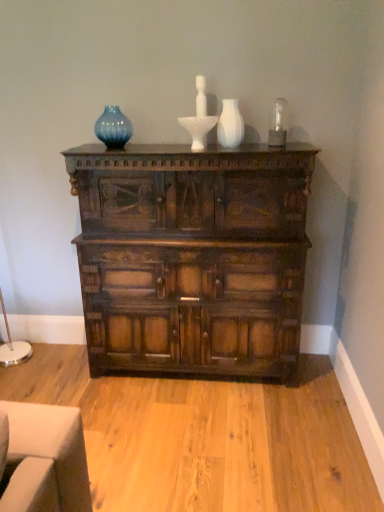
This screenshot has height=512, width=384. Describe the element at coordinates (192, 257) in the screenshot. I see `dark wood chest of drawers at center` at that location.

The height and width of the screenshot is (512, 384). In order to click on dark wood chest of drawers at center in this screenshot , I will do `click(192, 257)`.

What are the coordinates of `dark wood chest of drawers at center` in the screenshot? It's located at (192, 257).

Is white matte vase at center at the back of blue glass vase at upper center?

No.

From the image's perspective, is blue glass vase at upper center beneath white matte vase at center?

No, from the image's perspective, blue glass vase at upper center is not beneath white matte vase at center.

From their relative heights in the image, would you say blue glass vase at upper center is taller or shorter than white matte vase at center?

Clearly, blue glass vase at upper center is shorter compared to white matte vase at center.

How many degrees apart are the facing directions of blue glass vase at upper center and white matte vase at center?

1.41 degrees.

Would you say white matte vase at center is to the left or to the right of blue glass vase at upper center in the picture?

In the image, white matte vase at center appears on the right side of blue glass vase at upper center.

Measure the distance from white matte vase at center to blue glass vase at upper center.

white matte vase at center and blue glass vase at upper center are 26.08 inches apart.

Is white matte vase at center positioned with its back to blue glass vase at upper center?

No, white matte vase at center is not facing away from blue glass vase at upper center.

Is white matte vase at center next to blue glass vase at upper center?

white matte vase at center is not next to blue glass vase at upper center, and they're not touching.

Based on their sizes in the image, would you say white matte vase at center is bigger or smaller than dark wood chest of drawers at center?

In the image, white matte vase at center appears to be smaller than dark wood chest of drawers at center.

Could you tell me if white matte vase at center is facing dark wood chest of drawers at center?

No.

From a real-world perspective, between white matte vase at center and dark wood chest of drawers at center, who is vertically higher?

In real-world perspective, white matte vase at center is above.

Considering the relative sizes of white matte vase at center and dark wood chest of drawers at center in the image provided, is white matte vase at center wider than dark wood chest of drawers at center?

No, white matte vase at center is not wider than dark wood chest of drawers at center.

Considering the sizes of objects blue glass vase at upper center and dark wood chest of drawers at center in the image provided, who is bigger, blue glass vase at upper center or dark wood chest of drawers at center?

dark wood chest of drawers at center is bigger.

Considering the sizes of blue glass vase at upper center and dark wood chest of drawers at center in the image, is blue glass vase at upper center wider or thinner than dark wood chest of drawers at center?

In the image, blue glass vase at upper center appears to be more narrow than dark wood chest of drawers at center.

Could you tell me if blue glass vase at upper center is turned towards dark wood chest of drawers at center?

No, blue glass vase at upper center is not oriented towards dark wood chest of drawers at center.

Between point (115, 127) and point (288, 153), which one is positioned in front?

Positioned in front is point (288, 153).

Which of these two, dark wood chest of drawers at center or white matte vase at center, is bigger?

With larger size is dark wood chest of drawers at center.

From the image's perspective, is dark wood chest of drawers at center on white matte vase at center?

Incorrect, from the image's perspective, dark wood chest of drawers at center is lower than white matte vase at center.

Is dark wood chest of drawers at center in front of or behind white matte vase at center in the image?

dark wood chest of drawers at center is positioned closer to the viewer than white matte vase at center.

Based on the photo, in the image, is dark wood chest of drawers at center on the left side or the right side of white matte vase at center?

From the image, it's evident that dark wood chest of drawers at center is to the left of white matte vase at center.

Consider the image. Which object is further away from the camera taking this photo, dark wood chest of drawers at center or blue glass vase at upper center?

blue glass vase at upper center is behind.

Is dark wood chest of drawers at center smaller than blue glass vase at upper center?

Actually, dark wood chest of drawers at center might be larger than blue glass vase at upper center.

Which is in front, point (233, 300) or point (105, 140)?

Point (233, 300)

Can you confirm if dark wood chest of drawers at center is positioned to the right of blue glass vase at upper center?

Yes, dark wood chest of drawers at center is to the right of blue glass vase at upper center.

This screenshot has width=384, height=512. In order to click on vase that is under the blue glass vase at upper center (from a real-world perspective) in this screenshot , I will do `click(230, 125)`.

You are a GUI agent. You are given a task and a screenshot of the screen. Output one action in this format:
    pyautogui.click(x=<x>, y=<y>)
    Task: Click on the vase that appears below the blue glass vase at upper center (from the image's perspective)
    
    Given the screenshot: What is the action you would take?
    pyautogui.click(x=230, y=125)

Looking at the image, which one is located closer to dark wood chest of drawers at center, white matte vase at center or blue glass vase at upper center?

white matte vase at center is positioned closer to the anchor dark wood chest of drawers at center.

Based on their spatial positions, is blue glass vase at upper center or white matte vase at center closer to dark wood chest of drawers at center?

The object closer to dark wood chest of drawers at center is white matte vase at center.

Based on their spatial positions, is white matte vase at center or dark wood chest of drawers at center further from blue glass vase at upper center?

dark wood chest of drawers at center is positioned further to the anchor blue glass vase at upper center.

Looking at this image, based on their spatial positions, is dark wood chest of drawers at center or blue glass vase at upper center further from white matte vase at center?

Based on the image, dark wood chest of drawers at center appears to be further to white matte vase at center.

From the image, which object appears to be nearer to white matte vase at center, blue glass vase at upper center or dark wood chest of drawers at center?

Among the two, blue glass vase at upper center is located nearer to white matte vase at center.

Based on their spatial positions, is dark wood chest of drawers at center or white matte vase at center closer to blue glass vase at upper center?

Based on the image, white matte vase at center appears to be nearer to blue glass vase at upper center.

Locate an element on the screen. The height and width of the screenshot is (512, 384). vase between blue glass vase at upper center and dark wood chest of drawers at center from top to bottom is located at coordinates (230, 125).